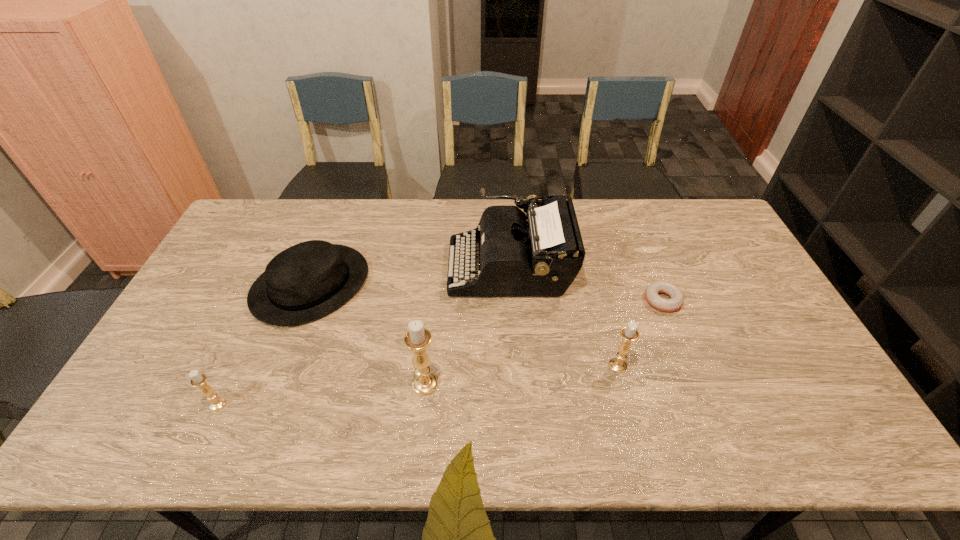
The height and width of the screenshot is (540, 960). I want to click on unoccupied position between the fedora and the tallest object, so click(x=368, y=335).

Find the location of a particular element. The image size is (960, 540). free spot between the rightmost object and the typewriter is located at coordinates (587, 284).

Locate an element on the screen. unoccupied position between the doughnut and the nearest object is located at coordinates (440, 352).

Locate an element on the screen. This screenshot has height=540, width=960. vacant area that lies between the typewriter and the fedora is located at coordinates (411, 276).

Identify which object is located as the fourth nearest to the third object from right to left. Please provide its 2D coordinates. Your answer should be formatted as a tuple, i.e. [(x, y)], where the tuple contains the x and y coordinates of a point satisfying the conditions above.

[(308, 280)]

Locate an element on the screen. object that is the fifth closest to the doughnut is located at coordinates (198, 379).

Select which candle holder is the second closest to the third object from right to left. Please provide its 2D coordinates. Your answer should be formatted as a tuple, i.e. [(x, y)], where the tuple contains the x and y coordinates of a point satisfying the conditions above.

[(417, 339)]

Choose which candle holder is the nearest neighbor to the typewriter. Please provide its 2D coordinates. Your answer should be formatted as a tuple, i.e. [(x, y)], where the tuple contains the x and y coordinates of a point satisfying the conditions above.

[(629, 333)]

Identify the location of free spot that satisfies the following two spatial constraints: 1. on the back side of the tallest object; 2. on the right side of the rightmost candle holder. This screenshot has width=960, height=540. (426, 366).

Locate an element on the screen. free space in the image that satisfies the following two spatial constraints: 1. on the typing side of the rightmost object; 2. on the left side of the fourth object from left to right is located at coordinates (513, 300).